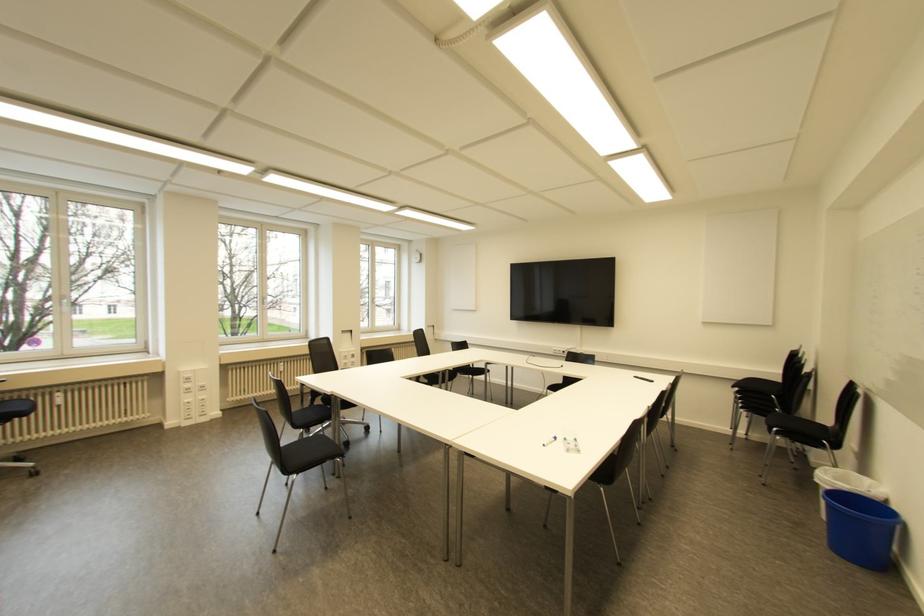
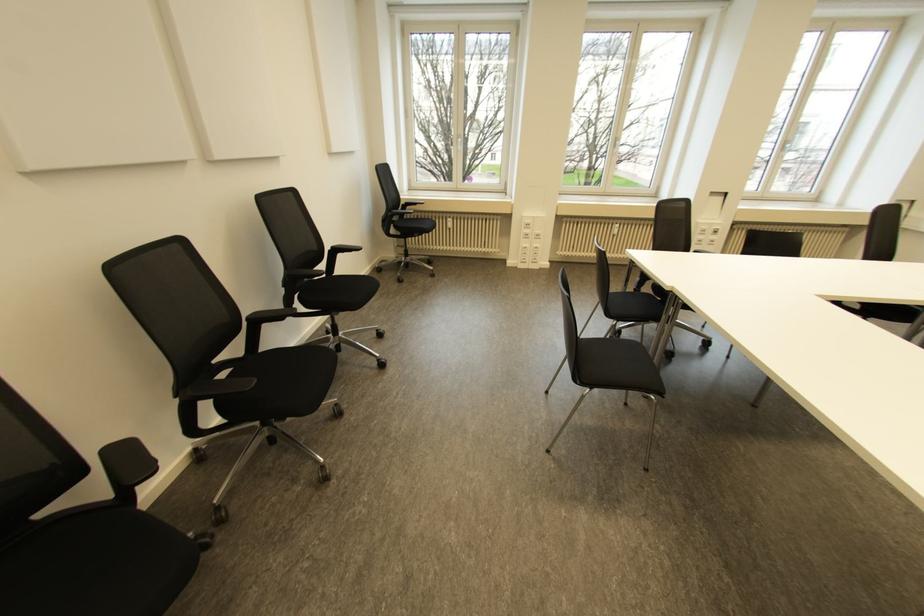
The first image is from the beginning of the video and the second image is from the end. How did the camera likely rotate when shooting the video?

The rotation direction of the camera is left-down.